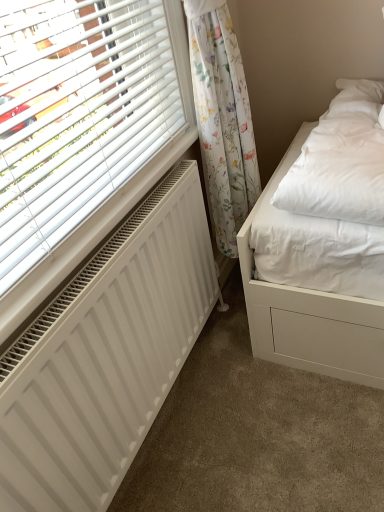
What do you see at coordinates (222, 119) in the screenshot?
I see `floral fabric curtain at upper right` at bounding box center [222, 119].

Where is `floral fabric curtain at upper right`? This screenshot has width=384, height=512. floral fabric curtain at upper right is located at coordinates (222, 119).

Find the location of a particular element. Image resolution: width=384 pixels, height=512 pixels. white matte radiator at lower left is located at coordinates 106,355.

What do you see at coordinates (106, 355) in the screenshot?
I see `white matte radiator at lower left` at bounding box center [106, 355].

The width and height of the screenshot is (384, 512). I want to click on floral fabric curtain at upper right, so click(222, 119).

Between white matte radiator at lower left and floral fabric curtain at upper right, which one appears on the left side from the viewer's perspective?

From the viewer's perspective, white matte radiator at lower left appears more on the left side.

Considering the positions of objects white matte radiator at lower left and floral fabric curtain at upper right in the image provided, who is behind, white matte radiator at lower left or floral fabric curtain at upper right?

floral fabric curtain at upper right is more distant.

Is point (110, 246) behind point (210, 152)?

No, it is in front of (210, 152).

From the image's perspective, would you say white matte radiator at lower left is positioned over floral fabric curtain at upper right?

No, from the image's perspective, white matte radiator at lower left is not over floral fabric curtain at upper right.

From a real-world perspective, is white matte radiator at lower left over floral fabric curtain at upper right?

No, from a real-world perspective, white matte radiator at lower left is not on top of floral fabric curtain at upper right.

Considering the sizes of white matte radiator at lower left and floral fabric curtain at upper right in the image, is white matte radiator at lower left wider or thinner than floral fabric curtain at upper right?

white matte radiator at lower left is thinner than floral fabric curtain at upper right.

Between white matte radiator at lower left and floral fabric curtain at upper right, which one has less height?

Standing shorter between the two is white matte radiator at lower left.

Who is smaller, white matte radiator at lower left or floral fabric curtain at upper right?

white matte radiator at lower left is smaller.

Is white matte radiator at lower left situated inside floral fabric curtain at upper right or outside?

white matte radiator at lower left exists outside the volume of floral fabric curtain at upper right.

Are white matte radiator at lower left and floral fabric curtain at upper right located far from each other?

white matte radiator at lower left is near floral fabric curtain at upper right, not far away.

From the picture: Is white matte radiator at lower left facing away from floral fabric curtain at upper right?

That's not correct — white matte radiator at lower left is not looking away from floral fabric curtain at upper right.

Can you tell me how much white matte radiator at lower left and floral fabric curtain at upper right differ in facing direction?

white matte radiator at lower left and floral fabric curtain at upper right are facing 1.33 degrees away from each other.

Where is `radiator below the floral fabric curtain at upper right (from a real-world perspective)`? This screenshot has width=384, height=512. radiator below the floral fabric curtain at upper right (from a real-world perspective) is located at coordinates (106, 355).

Which object is positioned more to the right, floral fabric curtain at upper right or white matte radiator at lower left?

floral fabric curtain at upper right.

Is floral fabric curtain at upper right in front of or behind white matte radiator at lower left in the image?

floral fabric curtain at upper right is behind white matte radiator at lower left.

Consider the image. Which is closer to the camera, (x=241, y=99) or (x=120, y=291)?

Positioned in front is point (x=120, y=291).

From the image's perspective, relative to white matte radiator at lower left, is floral fabric curtain at upper right above or below?

Clearly, from the image's perspective, floral fabric curtain at upper right is above white matte radiator at lower left.

From a real-world perspective, does floral fabric curtain at upper right stand above white matte radiator at lower left?

Indeed, from a real-world perspective, floral fabric curtain at upper right stands above white matte radiator at lower left.

From the picture: Is floral fabric curtain at upper right wider than white matte radiator at lower left?

Yes, floral fabric curtain at upper right is wider than white matte radiator at lower left.

Which of these two, floral fabric curtain at upper right or white matte radiator at lower left, stands shorter?

white matte radiator at lower left.

Does floral fabric curtain at upper right have a smaller size compared to white matte radiator at lower left?

Actually, floral fabric curtain at upper right might be larger than white matte radiator at lower left.

Can we say floral fabric curtain at upper right lies outside white matte radiator at lower left?

Yes, floral fabric curtain at upper right is outside of white matte radiator at lower left.

Are floral fabric curtain at upper right and white matte radiator at lower left located far from each other?

No.

Is floral fabric curtain at upper right oriented towards white matte radiator at lower left?

No, floral fabric curtain at upper right is not aimed at white matte radiator at lower left.

Can you tell me how much floral fabric curtain at upper right and white matte radiator at lower left differ in facing direction?

The angle between the facing direction of floral fabric curtain at upper right and the facing direction of white matte radiator at lower left is 1.33 degrees.

Image resolution: width=384 pixels, height=512 pixels. What are the coordinates of `curtain above the white matte radiator at lower left (from the image's perspective)` in the screenshot? It's located at (222, 119).

Where is `curtain behind the white matte radiator at lower left`? This screenshot has width=384, height=512. curtain behind the white matte radiator at lower left is located at coordinates (x=222, y=119).

What are the coordinates of `radiator that appears in front of the floral fabric curtain at upper right` in the screenshot? It's located at (106, 355).